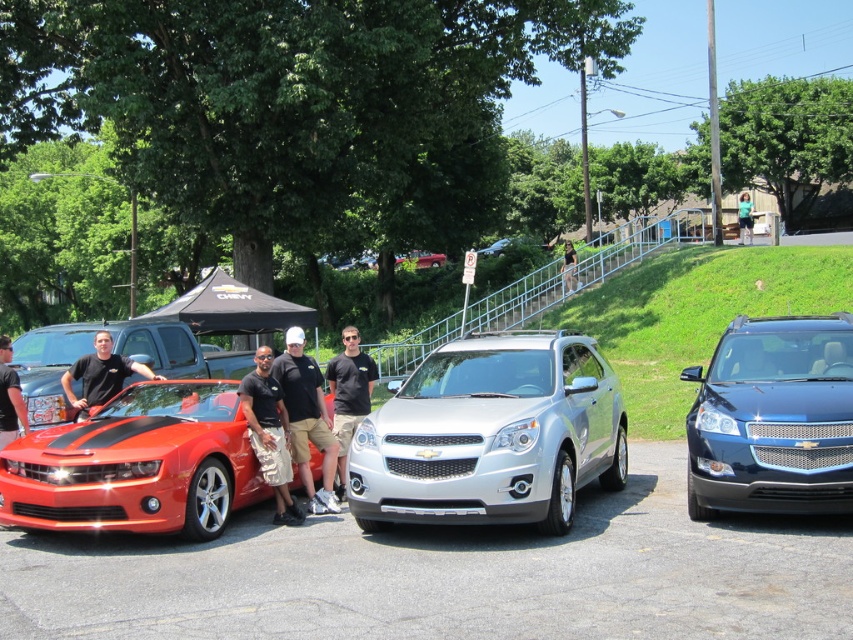
You are a GUI agent. You are given a task and a screenshot of the screen. Output one action in this format:
    pyautogui.click(x=<x>, y=<y>)
    Task: Click on the shiny orange car at left
    This screenshot has height=640, width=853.
    Given the screenshot: What is the action you would take?
    pyautogui.click(x=137, y=465)

At what (x,y) coordinates should I click in order to perform the action: click on shiny orange car at left. Please return your answer as a coordinate pair (x, y). The image size is (853, 640). Looking at the image, I should click on (137, 465).

Looking at this image, how distant is glossy blue suv at center from black matte shirt at center?

They are 4.20 meters apart.

Describe the element at coordinates (773, 419) in the screenshot. I see `glossy blue suv at center` at that location.

Locate an element on the screen. This screenshot has height=640, width=853. glossy blue suv at center is located at coordinates (773, 419).

Between glossy blue suv at center and black cotton shirt at center, which one has more height?

With more height is glossy blue suv at center.

Does glossy blue suv at center have a lesser height compared to black cotton shirt at center?

No, glossy blue suv at center is not shorter than black cotton shirt at center.

Between point (764, 444) and point (322, 490), which one is positioned in front?

Point (764, 444) is more forward.

Find the location of a particular element. The height and width of the screenshot is (640, 853). glossy blue suv at center is located at coordinates pos(773,419).